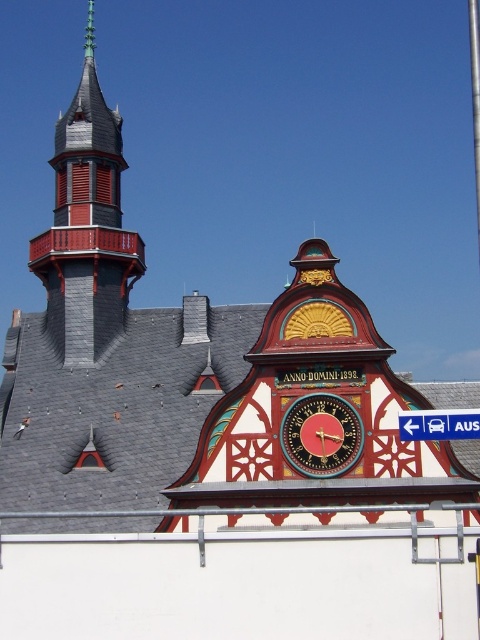
You are an architect examining the building facade. You need to determine the order in which objects appear from closest to farthest. Which is closer to you, the wooden clock face at center or the blue plastic sign at upper right?

The wooden clock face at center is closer to you than the blue plastic sign at upper right.

You are standing in front of the building and notice both the wooden clock face at center and the blue plastic sign at upper right. Which object is taller?

The wooden clock face at center is not as tall as the blue plastic sign at upper right, so the blue plastic sign at upper right is taller.